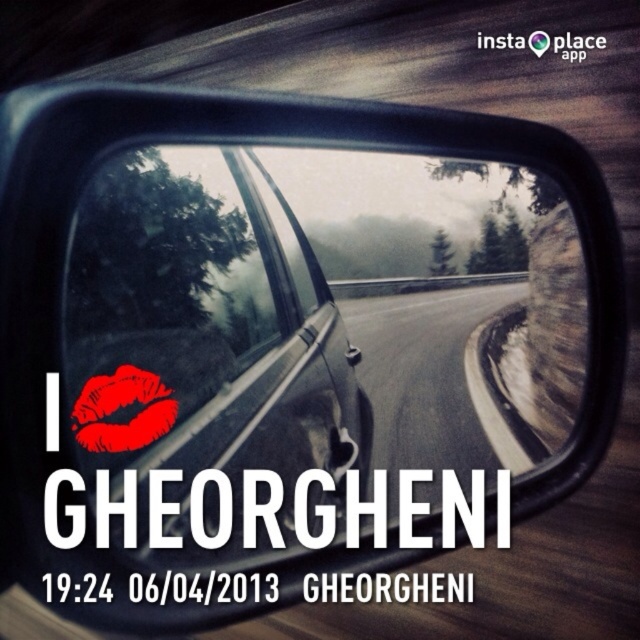
Who is shorter, glossy metallic mirror at upper center or red matte lips at center?

Standing shorter between the two is red matte lips at center.

Does point (195, 186) come in front of point (157, 374)?

No, it is behind (157, 374).

What do you see at coordinates (317, 346) in the screenshot? I see `glossy metallic mirror at upper center` at bounding box center [317, 346].

At what (x,y) coordinates should I click in order to perform the action: click on glossy metallic mirror at upper center. Please return your answer as a coordinate pair (x, y). Looking at the image, I should click on (317, 346).

Is matte black car window at center smaller than red matte lips at center?

No, matte black car window at center is not smaller than red matte lips at center.

Between matte black car window at center and red matte lips at center, which one appears on the left side from the viewer's perspective?

red matte lips at center is more to the left.

Does point (211, 243) come in front of point (138, 419)?

That is False.

Locate an element on the screen. Image resolution: width=640 pixels, height=640 pixels. matte black car window at center is located at coordinates (163, 298).

Who is more forward, (x=573, y=314) or (x=148, y=360)?

Point (x=148, y=360)

Does point (394, 278) come behind point (164, 362)?

Yes, it is.

Does point (396, 266) come behind point (90, 419)?

Yes, point (396, 266) is farther from viewer.

Find the location of a particular element. Image resolution: width=640 pixels, height=640 pixels. glossy metallic mirror at upper center is located at coordinates (317, 346).